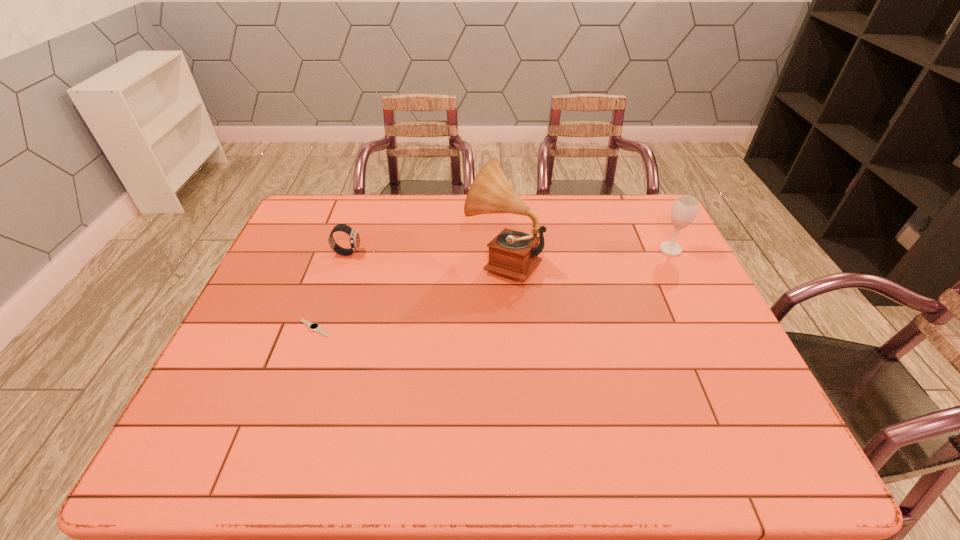
Find the location of a particular element. Image resolution: width=960 pixels, height=540 pixels. vacant area at the right edge is located at coordinates (713, 421).

In the image, there is a desktop. Where is `vacant space at the far left corner`? Image resolution: width=960 pixels, height=540 pixels. vacant space at the far left corner is located at coordinates (294, 222).

Identify the location of vacant space at the near left corner. (204, 465).

At what (x,y) coordinates should I click in order to perform the action: click on vacant space at the far right corner of the desktop. Please return your answer as a coordinate pair (x, y). Image resolution: width=960 pixels, height=540 pixels. Looking at the image, I should click on pyautogui.click(x=636, y=226).

The height and width of the screenshot is (540, 960). Identify the location of unoccupied position between the second shortest object and the phonograph record. (425, 256).

Find the location of a particular element. The width and height of the screenshot is (960, 540). free area in between the nearest object and the taller watch is located at coordinates (331, 290).

In order to click on vacant space that's between the nearest object and the third tallest object in this screenshot , I will do `click(331, 290)`.

This screenshot has width=960, height=540. Identify the location of unoccupied area between the nearer watch and the second tallest object. (492, 289).

Identify the location of empty space between the rightmost object and the shortest object. (492, 289).

I want to click on unoccupied area between the second object from right to left and the rightmost object, so click(x=587, y=255).